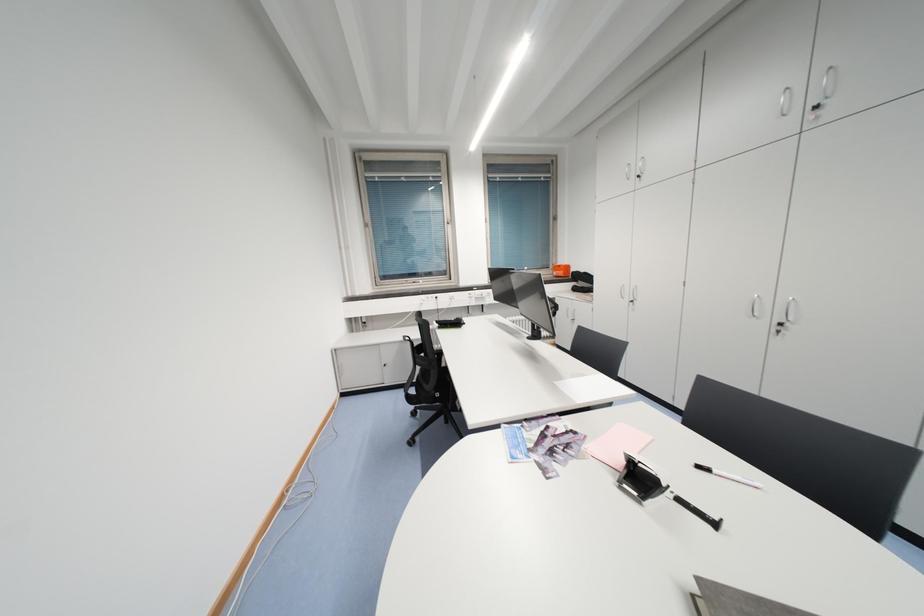
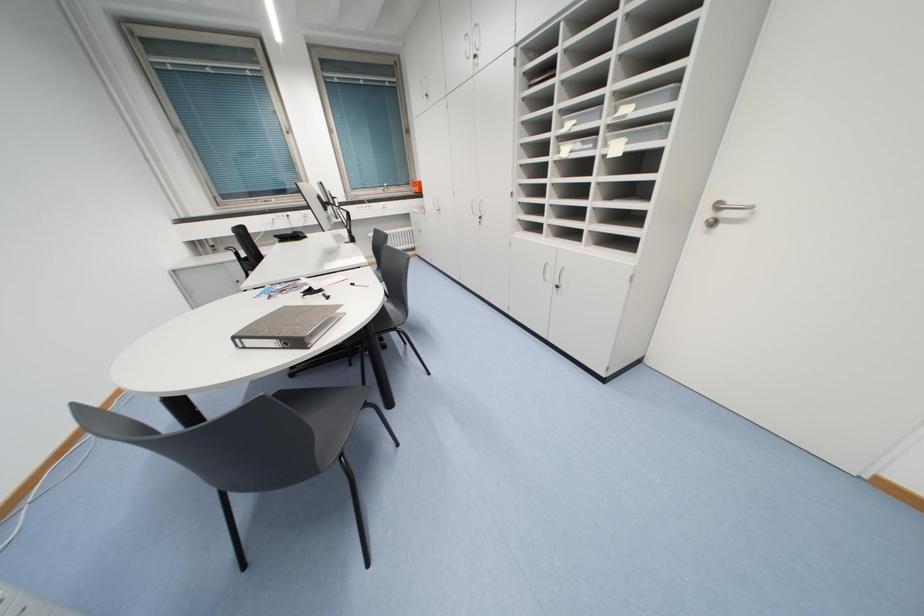
Which direction would the cameraman need to move to produce the second image?

The cameraman moved toward right, backward.